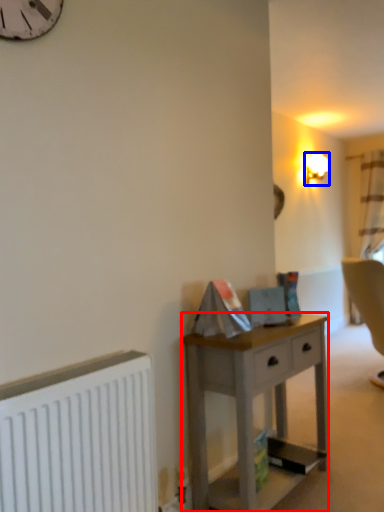
Question: Among these objects, which one is nearest to the camera, desk (highlighted by a red box) or lamp (highlighted by a blue box)?

Choices:
 (A) desk
 (B) lamp

Answer: (A)